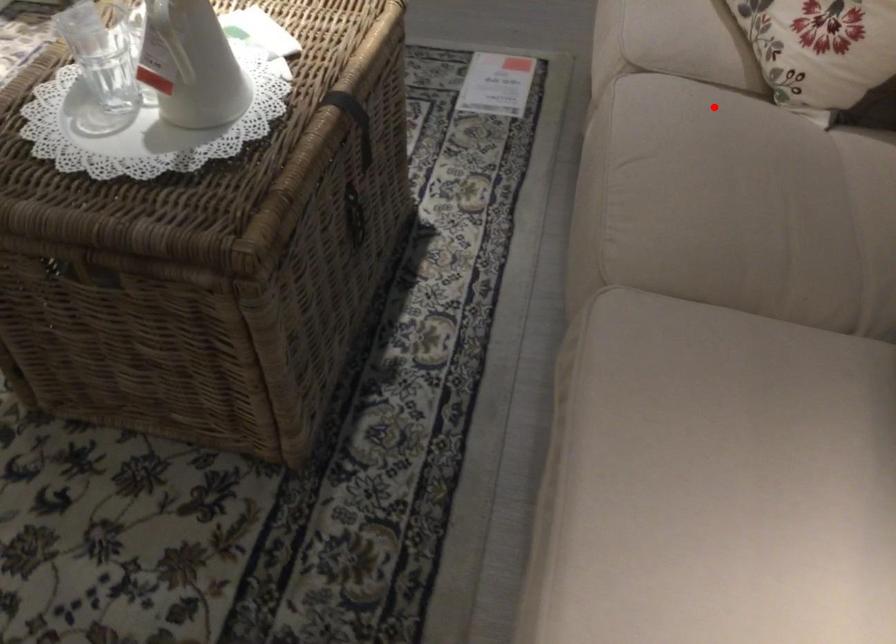
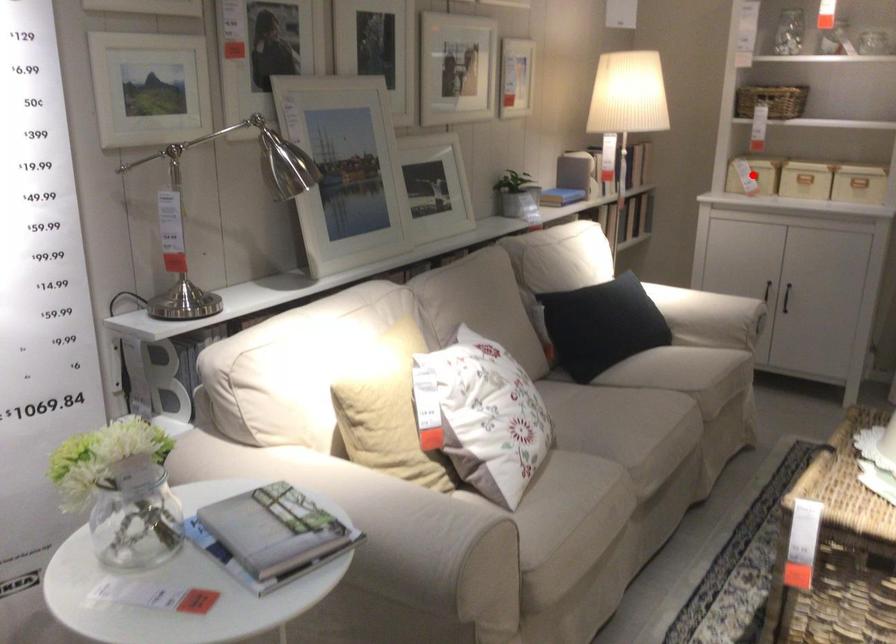
I am providing you with two images of the same scene from different viewpoints. A red point is marked on the first image and another point is marked on the second image. Is the marked point in image1 the same physical position as the marked point in image2?

No